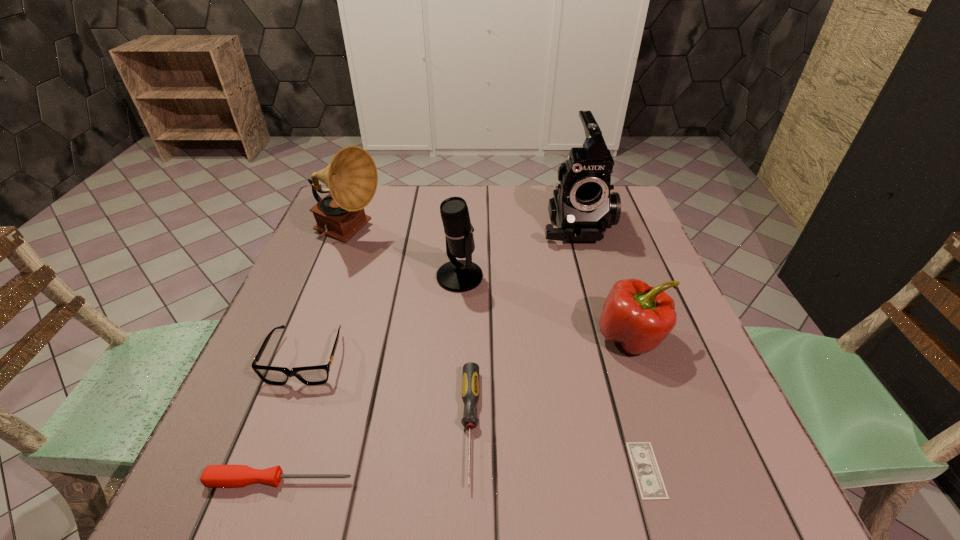
Identify the location of vacant space that satisfies the following two spatial constraints: 1. on the front-facing side of the money; 2. on the left side of the fifth tallest object. The height and width of the screenshot is (540, 960). (264, 470).

This screenshot has height=540, width=960. Identify the location of free region that satisfies the following two spatial constraints: 1. insert the right screwdriver into a screw head; 2. at the tip of the left screwdriver. (469, 480).